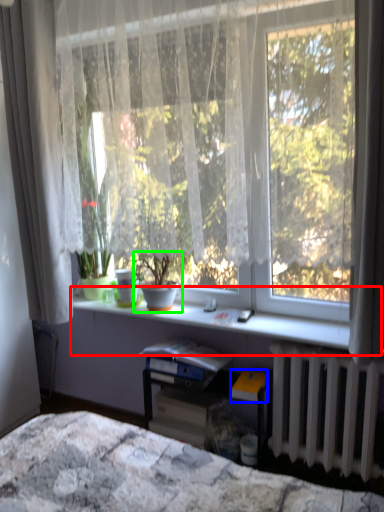
Question: Which object is positioned farthest from window sill (highlighted by a red box)? Select from paperback book (highlighted by a blue box) and houseplant (highlighted by a green box).

Choices:
 (A) paperback book
 (B) houseplant

Answer: (A)